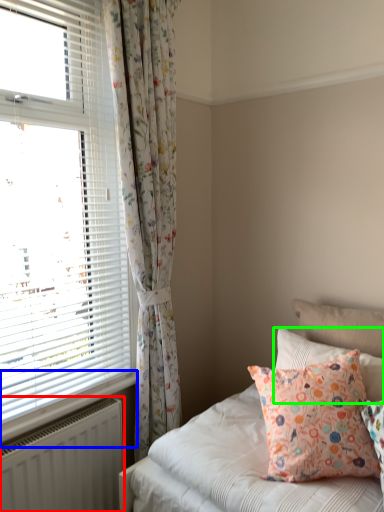
Question: Which is nearer to the radiator (highlighted by a red box)? window sill (highlighted by a blue box) or pillow (highlighted by a green box).

Choices:
 (A) window sill
 (B) pillow

Answer: (A)